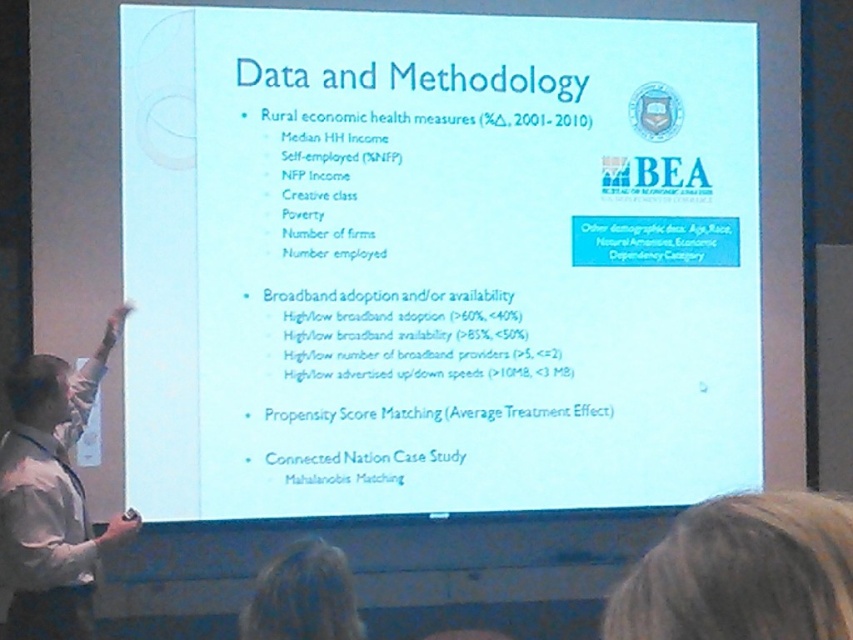
Who is positioned more to the left, blonde hair at upper right or white shirt at left?

Positioned to the left is white shirt at left.

Is blonde hair at upper right closer to the viewer compared to white shirt at left?

Yes, it is.

Find the location of a particular element. Image resolution: width=853 pixels, height=640 pixels. blonde hair at upper right is located at coordinates coord(741,572).

At what (x,y) coordinates should I click in order to perform the action: click on blonde hair at upper right. Please return your answer as a coordinate pair (x, y). This screenshot has height=640, width=853. Looking at the image, I should click on (741, 572).

Can you confirm if white paper at center is wider than blonde hair at lower center?

Yes, white paper at center is wider than blonde hair at lower center.

In the scene shown: Is white paper at center smaller than blonde hair at lower center?

No.

Is point (753, 180) more distant than point (262, 637)?

Yes, point (753, 180) is farther from viewer.

I want to click on white paper at center, so click(436, 260).

What are the coordinates of `white paper at center` in the screenshot? It's located at (436, 260).

Who is positioned more to the left, white paper at center or blonde hair at upper right?

white paper at center is more to the left.

Between point (323, 204) and point (695, 628), which one is positioned behind?

Point (323, 204)

I want to click on white paper at center, so click(436, 260).